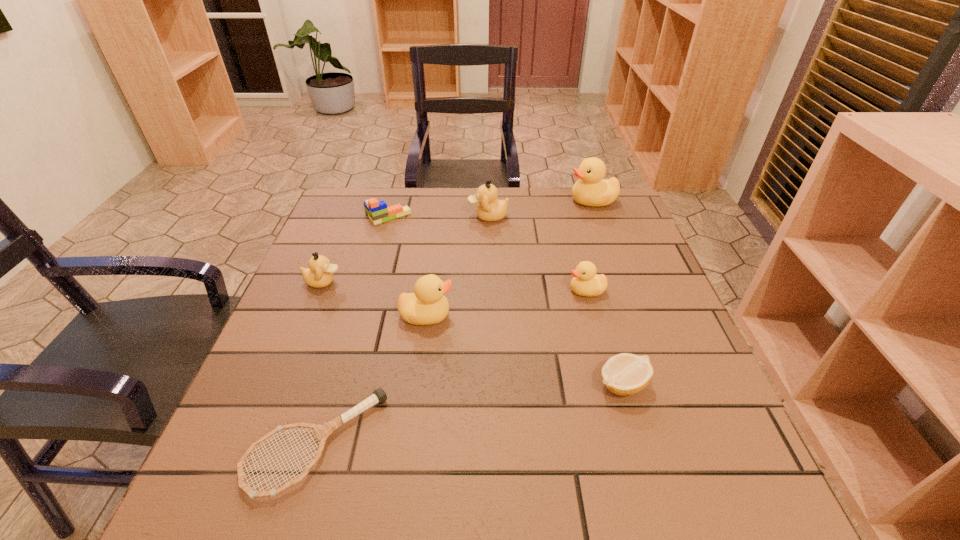
The image size is (960, 540). I want to click on duckling located at the left edge, so click(319, 274).

Find the location of `Lego at the left edge`. Lego at the left edge is located at coordinates (377, 211).

Locate an element on the screen. This screenshot has height=540, width=960. tennis racket that is at the left edge is located at coordinates (322, 431).

This screenshot has width=960, height=540. In order to click on lemon that is at the right edge in this screenshot , I will do `click(624, 374)`.

At what (x,y) coordinates should I click in order to perform the action: click on object situated at the far left corner. Please return your answer as a coordinate pair (x, y). This screenshot has height=540, width=960. Looking at the image, I should click on (377, 211).

The image size is (960, 540). In order to click on object that is positioned at the near left corner in this screenshot , I will do `click(322, 431)`.

The width and height of the screenshot is (960, 540). I want to click on object at the far right corner, so click(x=591, y=190).

Image resolution: width=960 pixels, height=540 pixels. In the image, there is a desktop. Find the location of `vacant area at the far edge`. vacant area at the far edge is located at coordinates (439, 227).

Find the location of a particular element. vacant area at the near edge of the desktop is located at coordinates (471, 467).

The image size is (960, 540). In order to click on free location at the left edge of the desktop in this screenshot , I will do `click(348, 250)`.